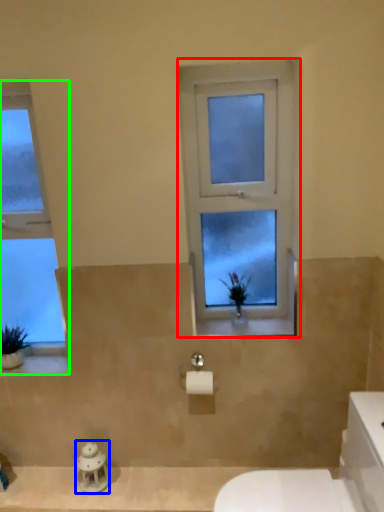
Question: Considering the real-world distances, which object is closest to window (highlighted by a red box)? figurine (highlighted by a blue box) or window (highlighted by a green box).

Choices:
 (A) figurine
 (B) window

Answer: (B)